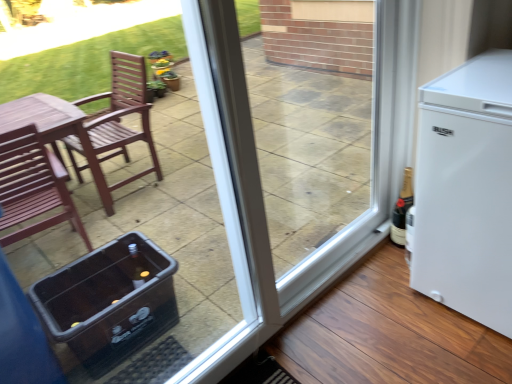
Question: Is transparent plastic cooler at lower left situated inside black glass bottle at right or outside?

Choices:
 (A) inside
 (B) outside

Answer: (B)

Question: Considering the positions of transparent plastic cooler at lower left and black glass bottle at right in the image, is transparent plastic cooler at lower left taller or shorter than black glass bottle at right?

Choices:
 (A) short
 (B) tall

Answer: (B)

Question: Which of these objects is positioned farthest from the transparent plastic cooler at lower left?

Choices:
 (A) white matte refrigerator at right
 (B) transparent glass screen door at center
 (C) black glass bottle at right

Answer: (C)

Question: Estimate the real-world distances between objects in this image. Which object is closer to the transparent plastic cooler at lower left?

Choices:
 (A) white matte refrigerator at right
 (B) transparent glass screen door at center
 (C) black glass bottle at right

Answer: (B)